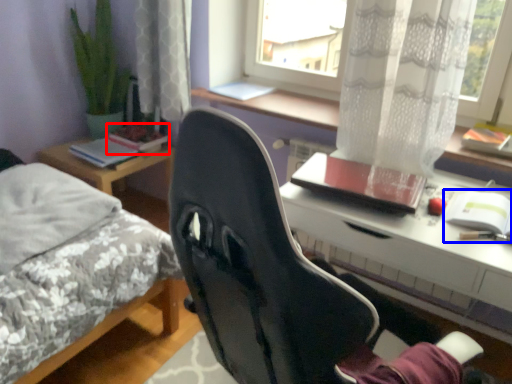
Question: Among these objects, which one is farthest to the camera, book (highlighted by a red box) or notebook (highlighted by a blue box)?

Choices:
 (A) book
 (B) notebook

Answer: (A)